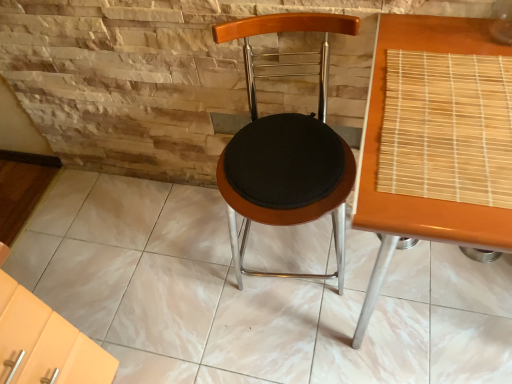
In order to click on free space above wooden bamboo mat at right (from a real-world perspective) in this screenshot , I will do `click(459, 109)`.